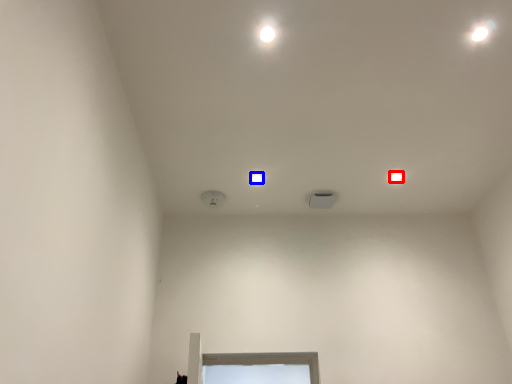
Question: Which of the following is the closest to the observer, dot (highlighted by a red box) or dot (highlighted by a blue box)?

Choices:
 (A) dot
 (B) dot

Answer: (B)